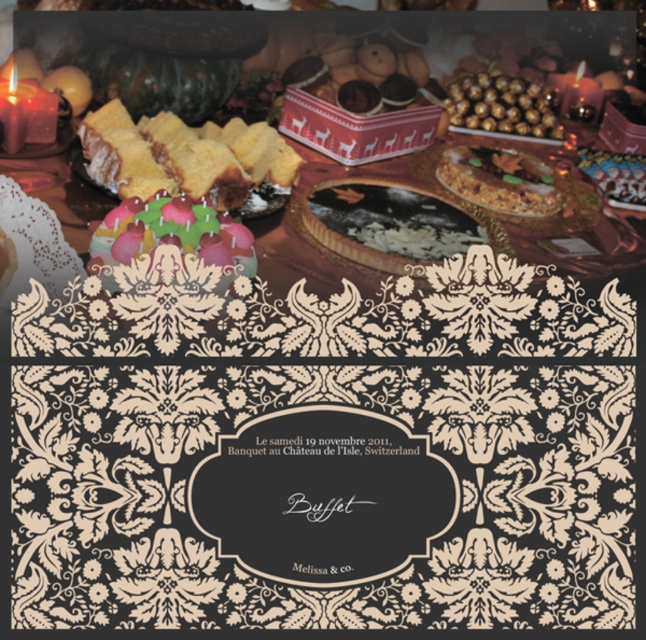
Question: Which is nearer to the white glossy pie at center?

Choices:
 (A) chocolate frosted cake at center
 (B) spongy golden cake at center

Answer: (A)

Question: Is white glossy pie at center wider than multicolored fondant cake at center?

Choices:
 (A) no
 (B) yes

Answer: (B)

Question: Is white glossy pie at center closer to camera compared to chocolate frosted cake at center?

Choices:
 (A) no
 (B) yes

Answer: (B)

Question: Does white glossy pie at center lie behind gold foil wrapped chocolates at upper center?

Choices:
 (A) yes
 (B) no

Answer: (B)

Question: Which of the following is the closest to the observer?

Choices:
 (A) (0, 285)
 (B) (388, 230)
 (C) (167, 218)

Answer: (A)

Question: Estimate the real-world distances between objects in this image. Which object is farther from the pastel frosted cake at left?

Choices:
 (A) multicolored fondant cake at center
 (B) gold foil wrapped chocolates at upper center
 (C) white glossy pie at center

Answer: (B)